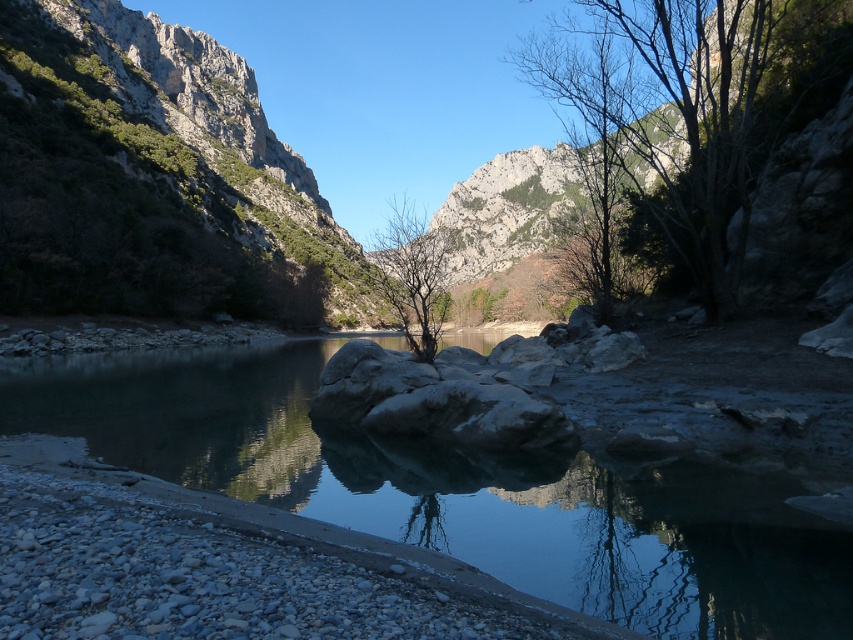
Question: Does green leafy tree at upper right have a greater width compared to bare branches at center?

Choices:
 (A) yes
 (B) no

Answer: (A)

Question: Which object is the closest to the green leafy tree at upper right?

Choices:
 (A) clear water at center
 (B) bare branches at center

Answer: (A)

Question: Among these objects, which one is nearest to the camera?

Choices:
 (A) green leafy tree at upper right
 (B) clear water at center
 (C) bare branches at center

Answer: (B)

Question: Among these objects, which one is farthest from the camera?

Choices:
 (A) clear water at center
 (B) green leafy tree at upper right

Answer: (B)

Question: Is clear water at center above bare branches at center?

Choices:
 (A) no
 (B) yes

Answer: (A)

Question: Where is green leafy tree at upper right located in relation to bare branches at center in the image?

Choices:
 (A) left
 (B) right

Answer: (B)